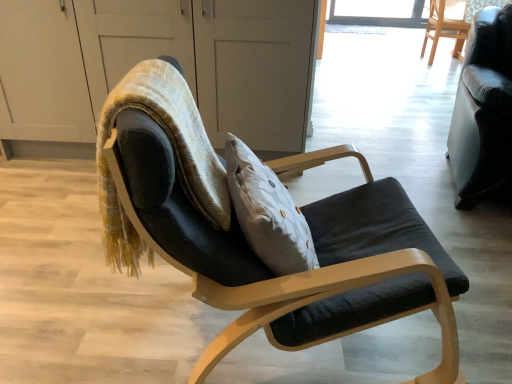
Question: Can you confirm if black leather couch at right, the second chair when ordered from bottom to top, is wider than velvet textured bean bag chair at center?

Choices:
 (A) no
 (B) yes

Answer: (B)

Question: Is velvet textured bean bag chair at center a part of black leather couch at right, the second chair when ordered from bottom to top?

Choices:
 (A) yes
 (B) no

Answer: (B)

Question: Is black leather couch at right, which is counted as the 2th chair, starting from the back, far from velvet textured bean bag chair at center?

Choices:
 (A) yes
 (B) no

Answer: (A)

Question: Does black leather couch at right, the second chair when ordered from bottom to top, appear on the left side of velvet textured bean bag chair at center?

Choices:
 (A) no
 (B) yes

Answer: (A)

Question: From a real-world perspective, does black leather couch at right, which is counted as the 2th chair, starting from the back, sit lower than velvet textured bean bag chair at center?

Choices:
 (A) no
 (B) yes

Answer: (B)

Question: Is black leather couch at right, placed as the 2th chair when sorted from left to right, taller than velvet textured bean bag chair at center?

Choices:
 (A) yes
 (B) no

Answer: (A)

Question: Can you confirm if velvet textured bean bag chair at center is taller than wooden chair at upper right, which is the first chair from top to bottom?

Choices:
 (A) yes
 (B) no

Answer: (B)

Question: Considering the relative sizes of velvet textured bean bag chair at center and wooden chair at upper right, arranged as the first chair when viewed from the back, in the image provided, is velvet textured bean bag chair at center shorter than wooden chair at upper right, arranged as the first chair when viewed from the back,?

Choices:
 (A) no
 (B) yes

Answer: (B)

Question: Could you tell me if velvet textured bean bag chair at center is facing wooden chair at upper right, which is the third chair from front to back?

Choices:
 (A) yes
 (B) no

Answer: (B)

Question: Is velvet textured bean bag chair at center turned away from wooden chair at upper right, arranged as the first chair when viewed from the back?

Choices:
 (A) yes
 (B) no

Answer: (B)

Question: From the image's perspective, does velvet textured bean bag chair at center appear higher than wooden chair at upper right, which is the first chair from top to bottom?

Choices:
 (A) no
 (B) yes

Answer: (A)

Question: Is the surface of velvet textured bean bag chair at center in direct contact with wooden chair at upper right, the 3th chair when ordered from left to right?

Choices:
 (A) no
 (B) yes

Answer: (A)

Question: From a real-world perspective, is velvet textured bean bag chair at center beneath matte black chair at center, arranged as the 3th chair when viewed from the right?

Choices:
 (A) no
 (B) yes

Answer: (A)